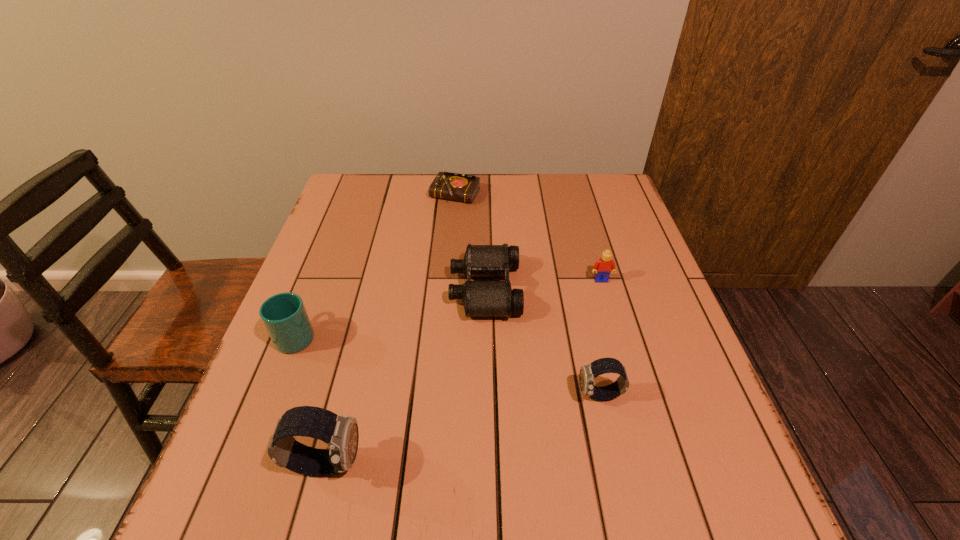
At what (x,y) coordinates should I click in order to perform the action: click on vacant space at the right edge of the desktop. Please return your answer as a coordinate pair (x, y). This screenshot has height=540, width=960. Looking at the image, I should click on (671, 363).

At what (x,y) coordinates should I click in order to perform the action: click on blank area at the far left corner. Please return your answer as a coordinate pair (x, y). This screenshot has height=540, width=960. Looking at the image, I should click on (343, 181).

Locate an element on the screen. free space at the far right corner is located at coordinates (600, 182).

Locate an element on the screen. The height and width of the screenshot is (540, 960). free space between the leftmost object and the left watch is located at coordinates (311, 399).

At what (x,y) coordinates should I click in order to perform the action: click on empty space between the diary and the binoculars. Please return your answer as a coordinate pair (x, y). Looking at the image, I should click on (470, 242).

You are a GUI agent. You are given a task and a screenshot of the screen. Output one action in this format:
    pyautogui.click(x=<x>, y=<y>)
    Task: Click on the free area in between the Lego and the binoculars
    This screenshot has height=540, width=960.
    Given the screenshot: What is the action you would take?
    pyautogui.click(x=543, y=285)

This screenshot has height=540, width=960. I want to click on vacant space that is in between the farther watch and the diary, so click(x=527, y=295).

The image size is (960, 540). In order to click on free space between the diary and the leftmost object in this screenshot , I will do `click(376, 265)`.

Find the location of a particular element. Image resolution: width=960 pixels, height=540 pixels. free space between the Lego and the leftmost object is located at coordinates (449, 307).

In order to click on free point between the cup and the farther watch in this screenshot , I will do `click(448, 365)`.